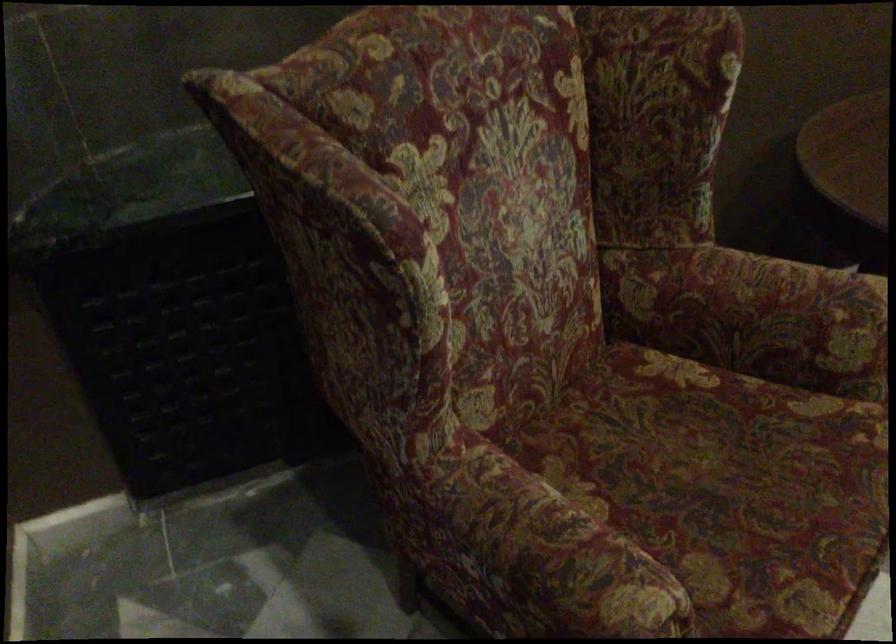
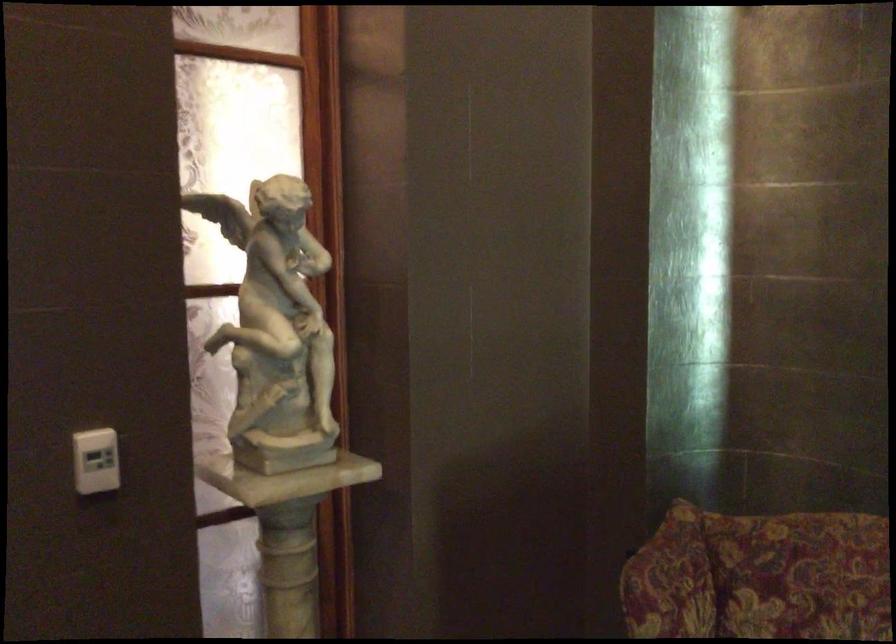
In the second image, find the point that corresponds to the point at 355,176 in the first image.

(670, 581)